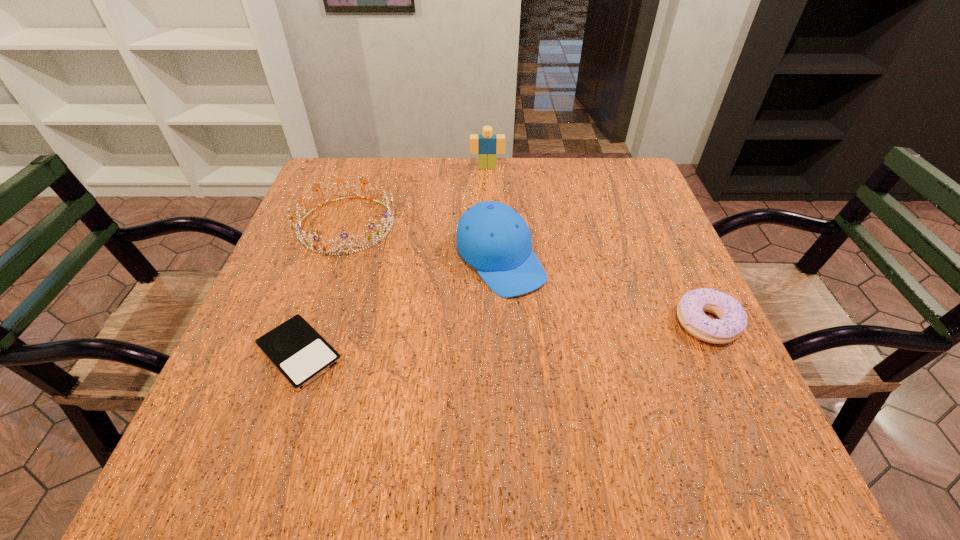
At what (x,y) coordinates should I click in order to perform the action: click on vacant space located 0.160m on the front-facing side of the third tallest object. Please return your answer as a coordinate pair (x, y). The image size is (960, 540). Looking at the image, I should click on (420, 282).

The image size is (960, 540). Find the location of `free space located 0.140m on the front-facing side of the cap`. free space located 0.140m on the front-facing side of the cap is located at coordinates (565, 342).

Where is `vacant area situated on the front-facing side of the cap`? vacant area situated on the front-facing side of the cap is located at coordinates (612, 396).

Find the location of a particular element. Image resolution: width=960 pixels, height=540 pixels. free space located 0.080m on the front-facing side of the cap is located at coordinates (547, 320).

Find the location of `vacant area located 0.190m on the face of the Lego`. vacant area located 0.190m on the face of the Lego is located at coordinates (490, 210).

The height and width of the screenshot is (540, 960). I want to click on free space located on the face of the Lego, so click(x=492, y=258).

This screenshot has width=960, height=540. What are the coordinates of `vacant space positioned on the face of the Lego` in the screenshot? It's located at (493, 267).

Image resolution: width=960 pixels, height=540 pixels. Find the location of `tiara at the far edge`. tiara at the far edge is located at coordinates (379, 235).

This screenshot has width=960, height=540. Find the location of `Lego positioned at the far edge`. Lego positioned at the far edge is located at coordinates (487, 145).

Locate an element on the screen. This screenshot has height=540, width=960. object at the near edge is located at coordinates (295, 348).